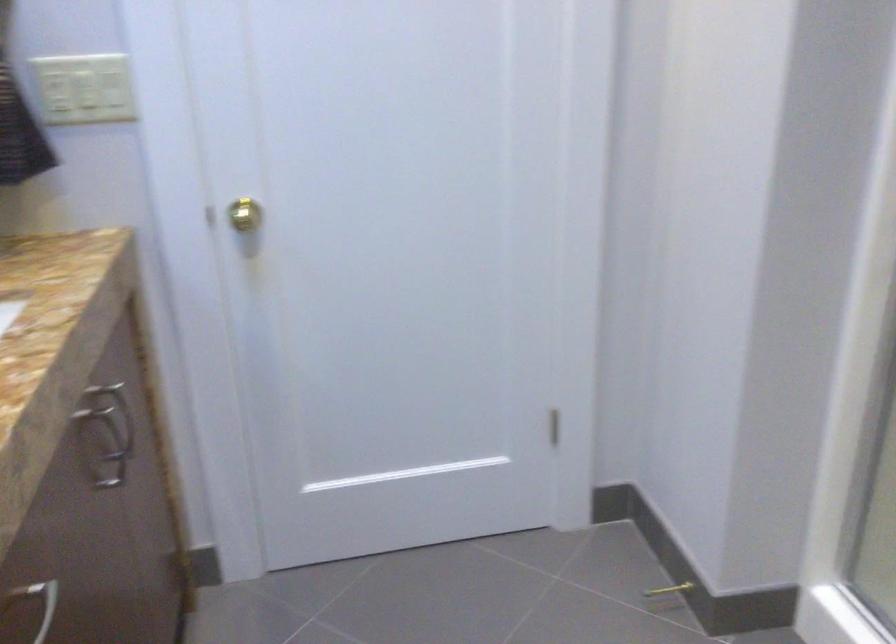
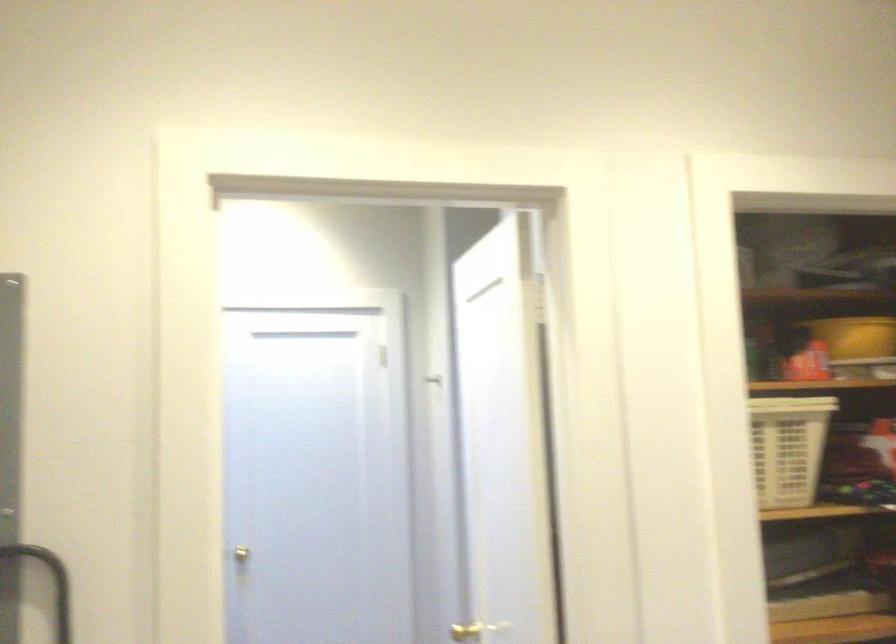
Question: I am providing you with two images of the same scene from different viewpoints. Which of the following objects are not visible in image2?

Choices:
 (A) light switch
 (B) purple hair tie
 (C) gold doorknob
 (D) white laundry basket

Answer: (A)